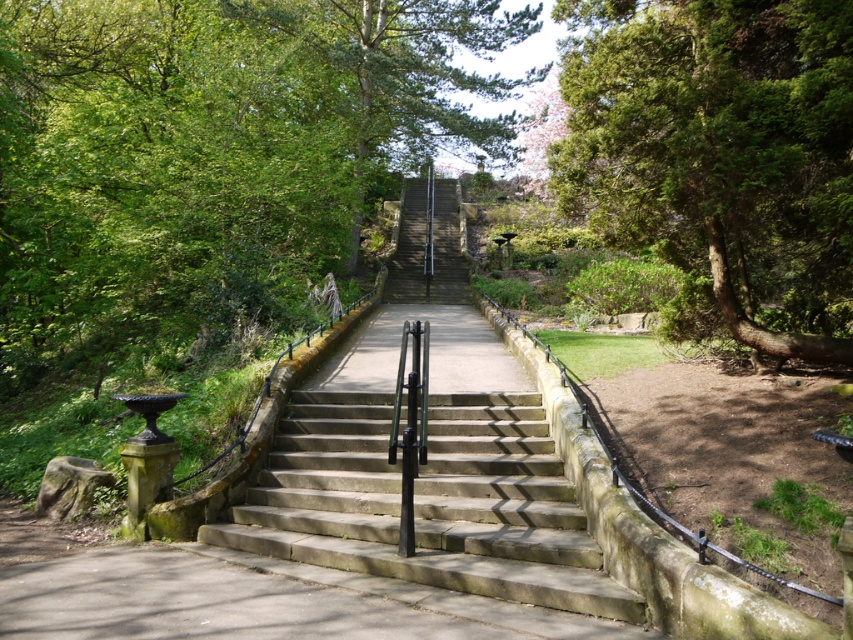
Question: Is green leafy tree at upper center bigger than stone stairs at center?

Choices:
 (A) yes
 (B) no

Answer: (A)

Question: Which of the following is the farthest from the observer?

Choices:
 (A) stone stairs at center
 (B) green textured tree at upper right

Answer: (B)

Question: Where is green leafy tree at upper center located in relation to green textured tree at upper right in the image?

Choices:
 (A) left
 (B) right

Answer: (A)

Question: Which object appears closest to the camera in this image?

Choices:
 (A) green textured tree at upper right
 (B) green leafy tree at upper center
 (C) stone stairs at center

Answer: (C)

Question: Can you confirm if green textured tree at upper right is smaller than stone stairs at center?

Choices:
 (A) yes
 (B) no

Answer: (A)

Question: Which object is the farthest from the green leafy tree at upper center?

Choices:
 (A) stone stairs at center
 (B) green textured tree at upper right

Answer: (B)